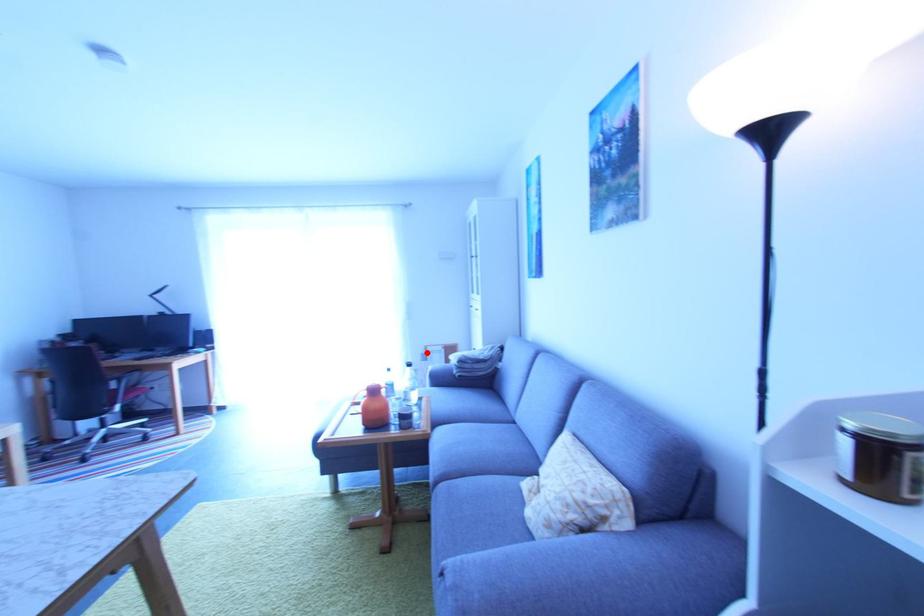
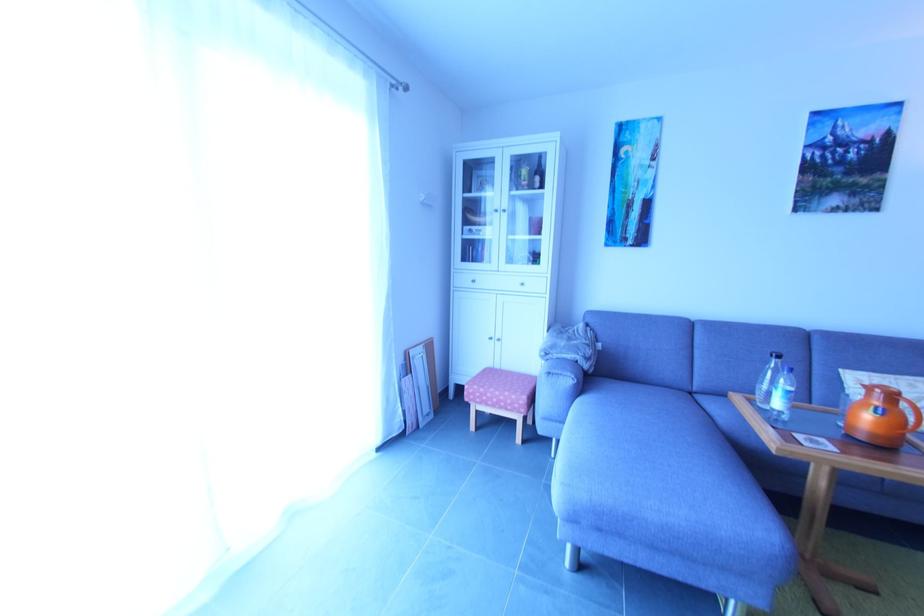
In the second image, find the point that corresponds to the highlighted location in the first image.

(406, 362)